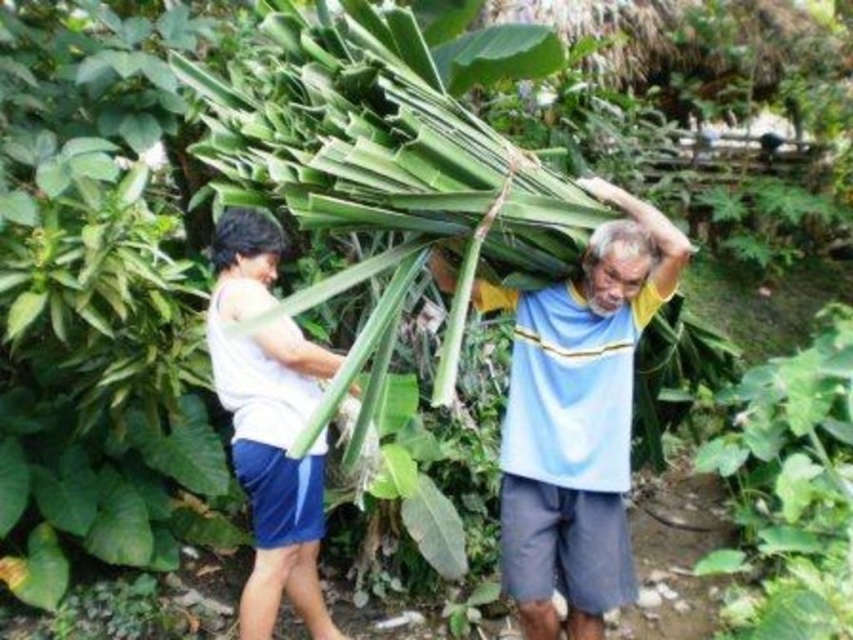
Looking at this image, you are a photographer trying to capture the scene of two people carrying banana leaves. You notice two points in the image at coordinates point [583,609] and point [280,422]. Which point is closer to you as the photographer?

Point [583,609] is closer to the viewer than point [280,422].

Based on the scene described, which individual is shorter in height between the person wearing the light blue striped shirt at upper center and the one in the white matte tank top at left?

The light blue striped shirt at upper center is not as tall as the white matte tank top at left, so the person in the light blue striped shirt at upper center is shorter.